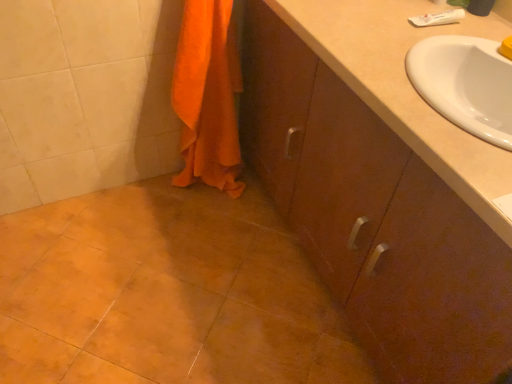
Where is `vacant region to the right of orange cotton towel at lower left`? vacant region to the right of orange cotton towel at lower left is located at coordinates (258, 203).